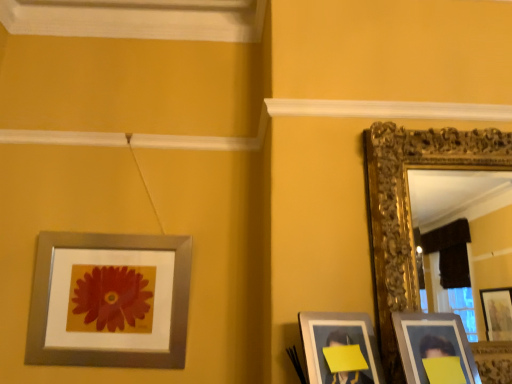
Question: Is silver metallic picture frame at upper left, the fourth picture frame viewed from the right, looking in the opposite direction of matte silver picture frame at lower right, which ranks as the third picture frame in left-to-right order?

Choices:
 (A) yes
 (B) no

Answer: (B)

Question: Is silver metallic picture frame at upper left, which is the first picture frame in left-to-right order, wider than matte silver picture frame at lower right, which ranks as the third picture frame in left-to-right order?

Choices:
 (A) no
 (B) yes

Answer: (B)

Question: Is silver metallic picture frame at upper left, which is the first picture frame in left-to-right order, touching matte silver picture frame at lower right, the second picture frame when ordered from right to left?

Choices:
 (A) no
 (B) yes

Answer: (A)

Question: From a real-world perspective, is silver metallic picture frame at upper left, which is the first picture frame in left-to-right order, physically below matte silver picture frame at lower right, which ranks as the third picture frame in left-to-right order?

Choices:
 (A) yes
 (B) no

Answer: (B)

Question: From the image's perspective, does silver metallic picture frame at upper left, the fourth picture frame viewed from the right, appear higher than matte silver picture frame at lower right, which ranks as the third picture frame in left-to-right order?

Choices:
 (A) yes
 (B) no

Answer: (A)

Question: Considering the relative sizes of silver metallic picture frame at upper left, the fourth picture frame viewed from the right, and matte silver picture frame at lower right, which ranks as the third picture frame in left-to-right order, in the image provided, is silver metallic picture frame at upper left, the fourth picture frame viewed from the right, smaller than matte silver picture frame at lower right, which ranks as the third picture frame in left-to-right order,?

Choices:
 (A) no
 (B) yes

Answer: (A)

Question: From the image's perspective, is matte silver picture frame at lower right, the 2th picture frame viewed from the left, located beneath silver metallic picture frame at upper left, the fourth picture frame viewed from the right?

Choices:
 (A) yes
 (B) no

Answer: (A)

Question: Is matte silver picture frame at lower right, the 2th picture frame viewed from the left, at the right side of silver metallic picture frame at upper left, which is the first picture frame in left-to-right order?

Choices:
 (A) no
 (B) yes

Answer: (B)

Question: Is matte silver picture frame at lower right, which is the third picture frame in right-to-left order, outside silver metallic picture frame at upper left, which is the first picture frame in left-to-right order?

Choices:
 (A) no
 (B) yes

Answer: (B)

Question: Considering the relative positions of matte silver picture frame at lower right, the 2th picture frame viewed from the left, and silver metallic picture frame at upper left, the fourth picture frame viewed from the right, in the image provided, is matte silver picture frame at lower right, the 2th picture frame viewed from the left, behind silver metallic picture frame at upper left, the fourth picture frame viewed from the right,?

Choices:
 (A) no
 (B) yes

Answer: (A)

Question: Can you confirm if matte silver picture frame at lower right, the 2th picture frame viewed from the left, is shorter than silver metallic picture frame at upper left, which is the first picture frame in left-to-right order?

Choices:
 (A) no
 (B) yes

Answer: (B)

Question: Can you confirm if matte silver picture frame at lower right, which is the third picture frame in right-to-left order, is wider than silver metallic picture frame at upper left, the fourth picture frame viewed from the right?

Choices:
 (A) yes
 (B) no

Answer: (A)

Question: Is silver metallic picture frame at upper left, the fourth picture frame viewed from the right, wider than matte silver picture frame at lower right, the 2th picture frame viewed from the left?

Choices:
 (A) yes
 (B) no

Answer: (B)